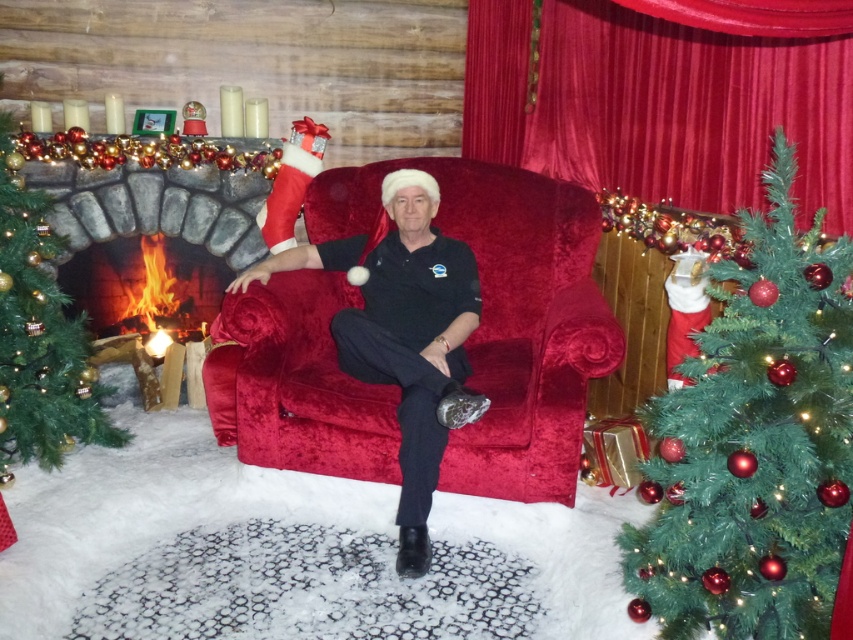
You are a photographer setting up for a holiday photo shoot. You need to ensure that the velvet curtain at upper center and the black velvet pants at center are both visible in the frame. Based on their positions, which object is wider and might require more space in the composition?

The velvet curtain at upper center might be wider than the black velvet pants at center, so it requires more space in the composition.

You are a photographer setting up for a holiday photo shoot. You notice the velvet curtain at upper center and the black velvet pants at center in the scene. Which object is closer to the camera?

The velvet curtain at upper center is closer to the camera because it is in front of the black velvet pants at center.